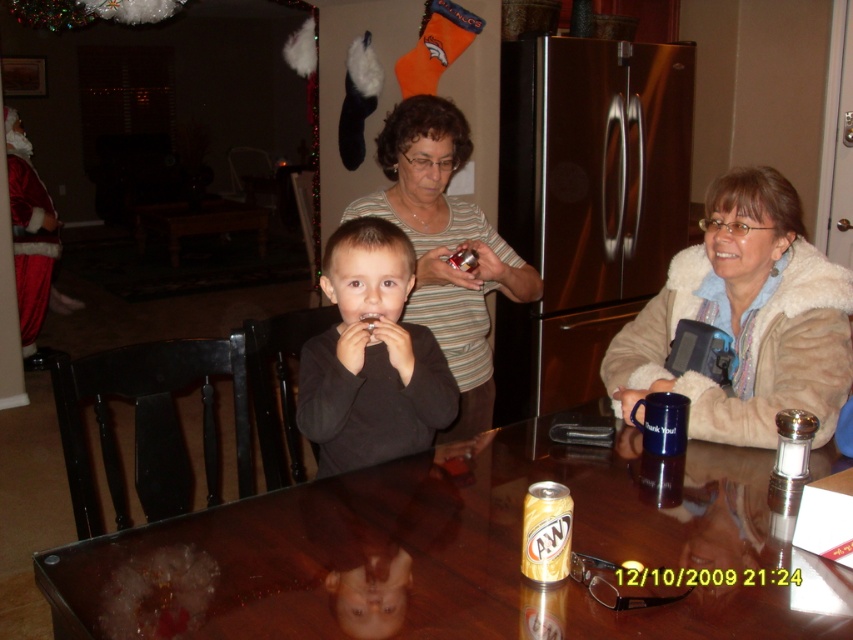
You are sitting at the glossy brown table at center and want to hand a gift to the person wearing the black matte shirt at center. Can you reach them without leaving your seat?

The glossy brown table at center is closer to the viewer than the black matte shirt at center, meaning the person is farther away. You might need to extend your arm or ask them to come closer to reach them without leaving your seat.

You are a guest standing at the entrance of the dining room. You want to grab the salt shaker from the glossy brown table at center. Can you reach it without moving closer than your current position?

The glossy brown table at center is 1.10 meters from viewer. Since the table is within typical reaching distance for most people, you can likely reach the salt shaker without moving closer.